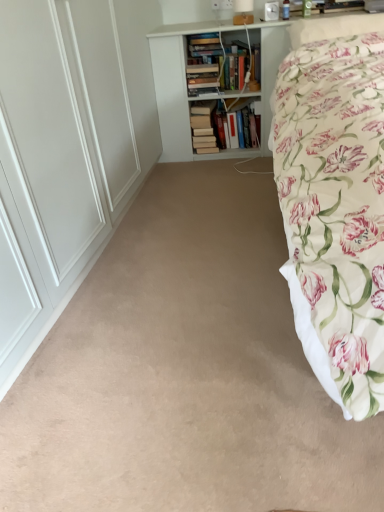
Question: Should I look upward or downward to see floral fabric bed at right?

Choices:
 (A) up
 (B) down

Answer: (A)

Question: From a real-world perspective, is white wooden bookcase at upper center below hardcover books at center?

Choices:
 (A) no
 (B) yes

Answer: (A)

Question: From the image's perspective, is white wooden bookcase at upper center below hardcover books at center?

Choices:
 (A) yes
 (B) no

Answer: (B)

Question: Would you say white wooden bookcase at upper center is outside hardcover books at center?

Choices:
 (A) no
 (B) yes

Answer: (B)

Question: Does white wooden bookcase at upper center have a greater height compared to hardcover books at center?

Choices:
 (A) yes
 (B) no

Answer: (A)

Question: Does white wooden bookcase at upper center have a lesser width compared to hardcover books at center?

Choices:
 (A) no
 (B) yes

Answer: (A)

Question: Can you confirm if white wooden bookcase at upper center is bigger than hardcover books at center?

Choices:
 (A) yes
 (B) no

Answer: (A)

Question: Is floral fabric bed at right oriented towards white wooden bookcase at upper center?

Choices:
 (A) yes
 (B) no

Answer: (B)

Question: From a real-world perspective, is floral fabric bed at right positioned over white wooden bookcase at upper center based on gravity?

Choices:
 (A) no
 (B) yes

Answer: (A)

Question: From the image's perspective, does floral fabric bed at right appear lower than white wooden bookcase at upper center?

Choices:
 (A) no
 (B) yes

Answer: (B)

Question: Does floral fabric bed at right have a greater width compared to white wooden bookcase at upper center?

Choices:
 (A) yes
 (B) no

Answer: (A)

Question: Is white wooden bookcase at upper center located within floral fabric bed at right?

Choices:
 (A) yes
 (B) no

Answer: (B)

Question: Is floral fabric bed at right smaller than white wooden bookcase at upper center?

Choices:
 (A) no
 (B) yes

Answer: (A)

Question: Can you confirm if hardcover books at center is bigger than white wooden bookcase at upper center?

Choices:
 (A) no
 (B) yes

Answer: (A)